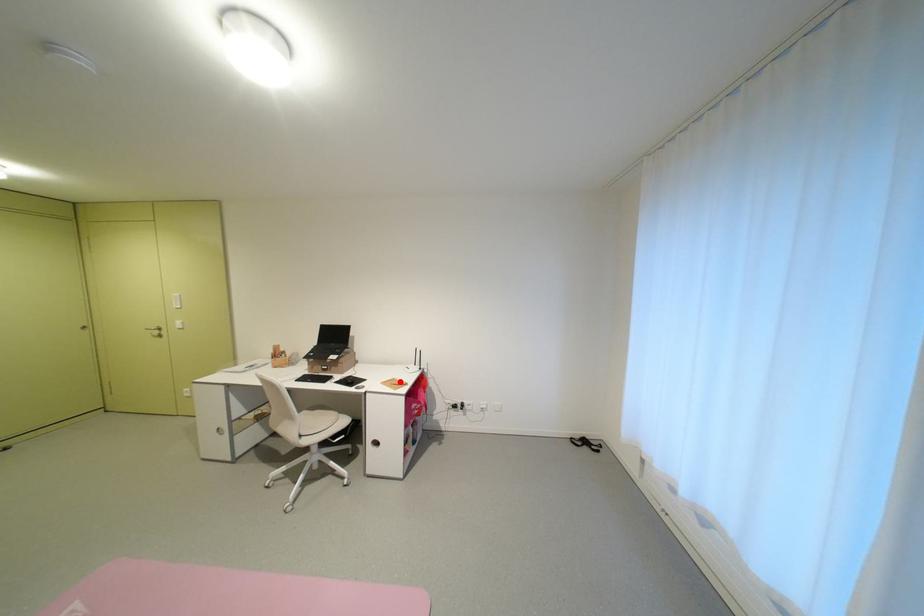
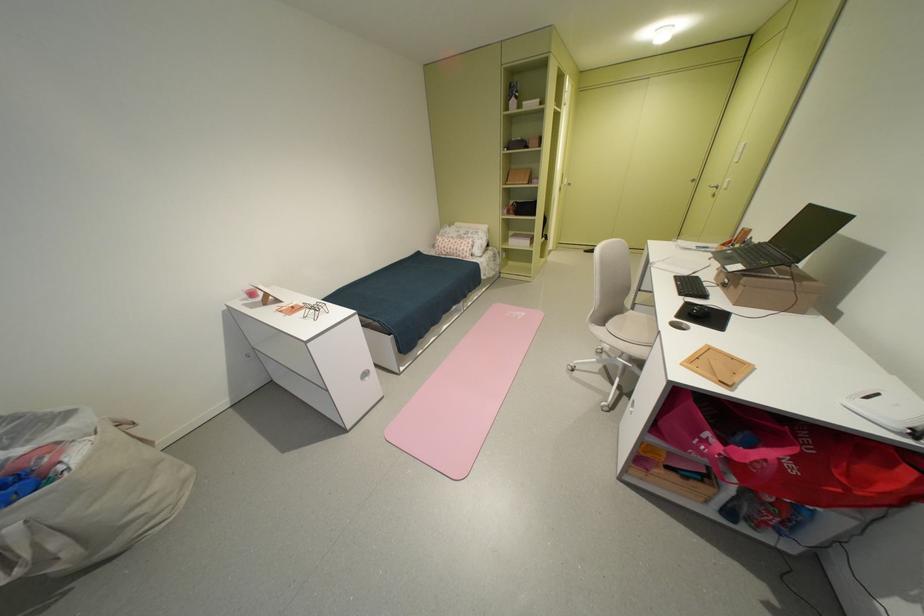
Locate, in the second image, the point that corresponds to the highlighted location in the first image.

(743, 360)